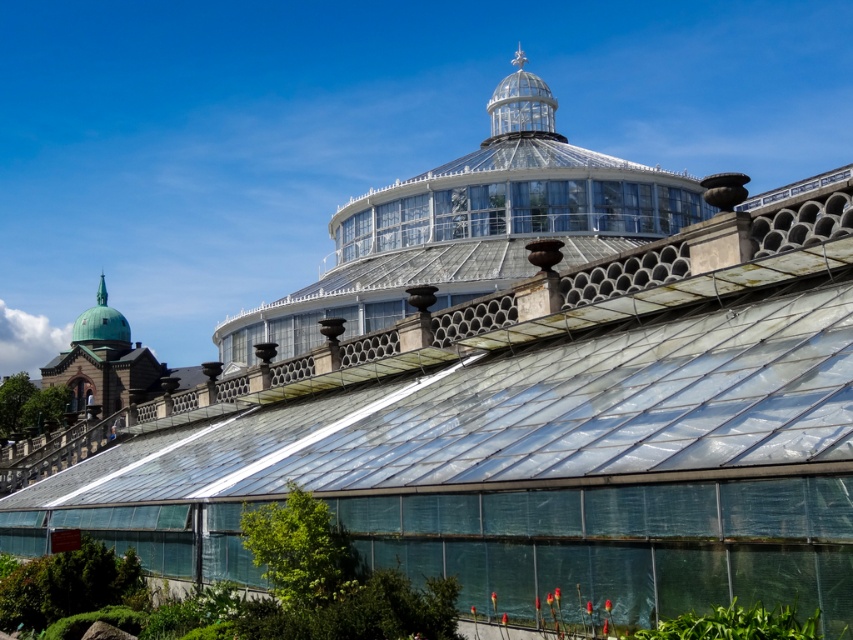
Between transparent glass dome at center and transparent plastic garden at lower center, which one has more height?

transparent glass dome at center

Is transparent glass dome at center above transparent plastic garden at lower center?

Yes.

Which is in front, point (453, 301) or point (639, 568)?

Positioned in front is point (639, 568).

Identify the location of transparent glass dome at center. (473, 225).

Does transparent plastic garden at lower center appear under green copper dome at upper left?

Yes.

Image resolution: width=853 pixels, height=640 pixels. Describe the element at coordinates (630, 577) in the screenshot. I see `transparent plastic garden at lower center` at that location.

Does point (814, 605) lie in front of point (96, 316)?

Yes, point (814, 605) is in front of point (96, 316).

Identify the location of transparent plastic garden at lower center. The width and height of the screenshot is (853, 640). (630, 577).

Which is behind, point (306, 348) or point (120, 316)?

Point (120, 316)

Does transparent glass dome at center have a smaller size compared to green copper dome at upper left?

No.

Does point (494, 275) lie in front of point (84, 340)?

Yes, point (494, 275) is closer to viewer.

At what (x,y) coordinates should I click in order to perform the action: click on transparent glass dome at center. Please return your answer as a coordinate pair (x, y). The height and width of the screenshot is (640, 853). Looking at the image, I should click on (473, 225).